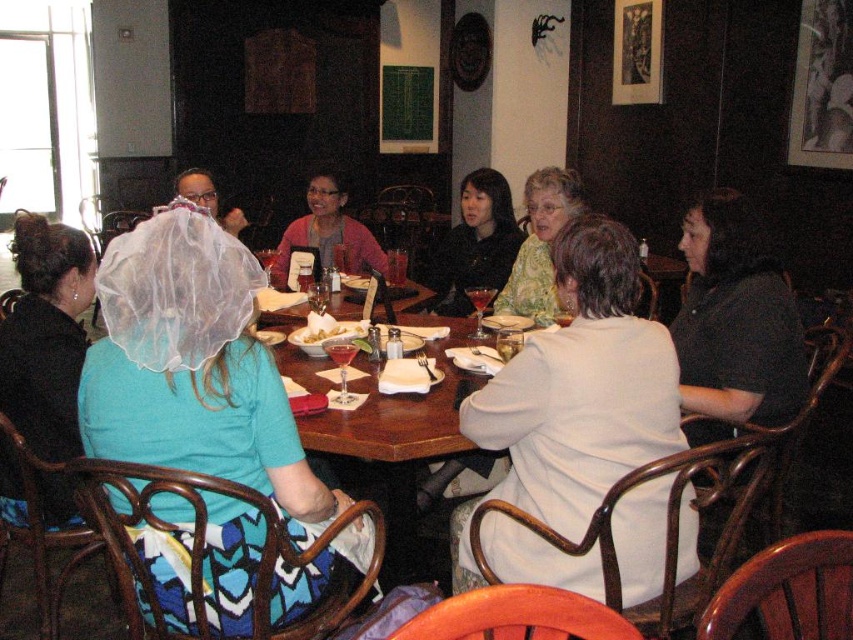
You are standing at the edge of the dining table in the cozy restaurant scene. There are two points marked on the table surface. The first point is at coordinates point [669,380] and the second is at point [538,184]. If you want to reach the point that is closer to you first, which coordinate should you move towards?

You should move towards point [669,380] because it is closer to the viewer than point [538,184].

You are a waiter in a restaurant. You need to place a new dessert plate between the matte black dress at center and the smooth white bowl at center. Which object should you move to make space?

The matte black dress at center is bigger than the smooth white bowl at center, so you should move the matte black dress at center to make space for the dessert plate.

You are a photographer taking a picture of the dining table. You notice two points of interest marked as point (672, 339) and point (451, 294). Which point will appear larger in your photo?

Point (672, 339) is closer to the camera than point (451, 294), so it will appear larger in the photo.